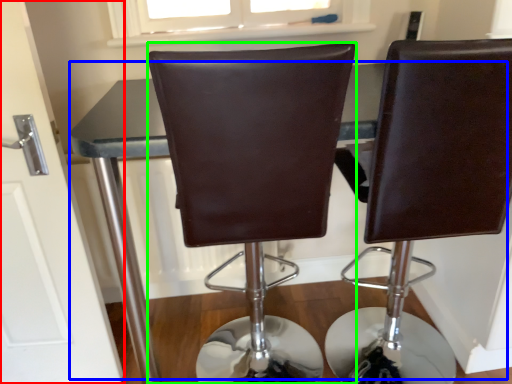
Question: Based on their relative distances, which object is farther from door (highlighted by a red box)? Choose from table (highlighted by a blue box) and chair (highlighted by a green box).

Choices:
 (A) table
 (B) chair

Answer: (B)